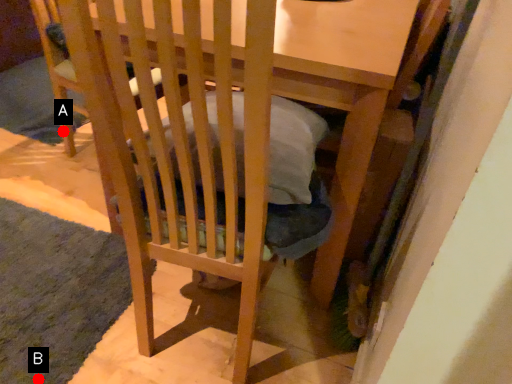
Question: Two points are circled on the image, labeled by A and B beside each circle. Which point is closer to the camera?

Choices:
 (A) A is closer
 (B) B is closer

Answer: (B)